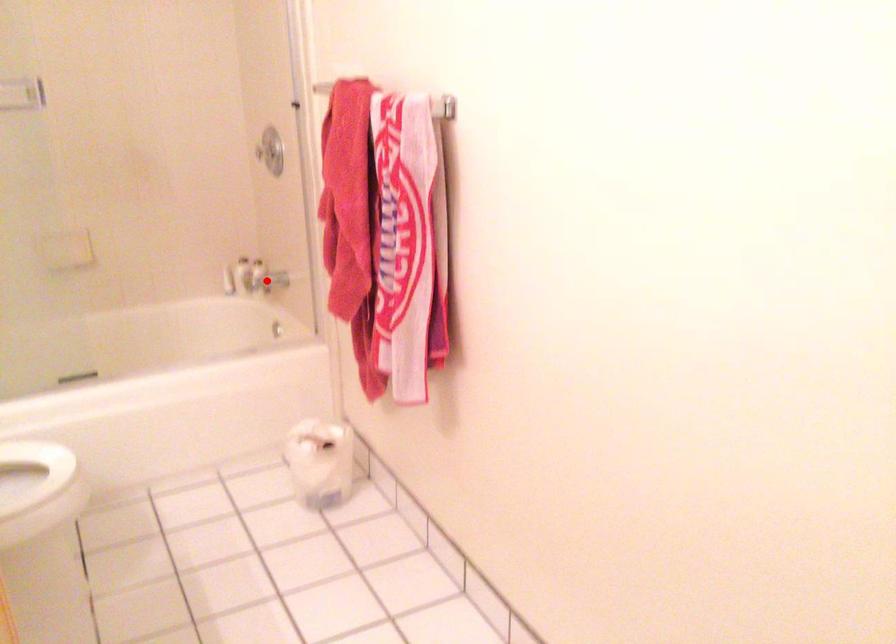
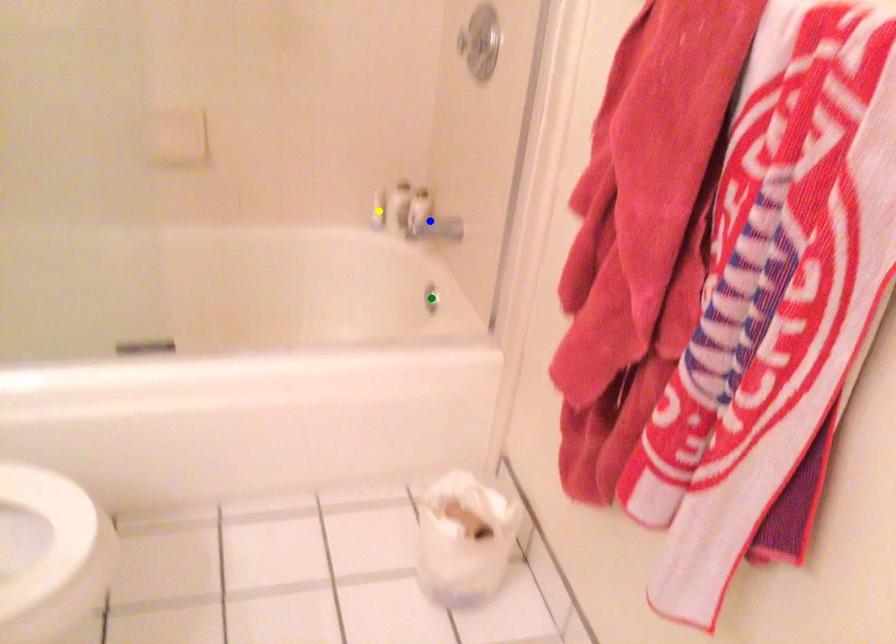
Question: I am providing you with two images of the same scene from different viewpoints. A red point is marked on the first image. You are given multiple points on the second image. In image 2, which mark is for the same physical point as the one in image 1?

Choices:
 (A) green point
 (B) blue point
 (C) yellow point

Answer: (B)